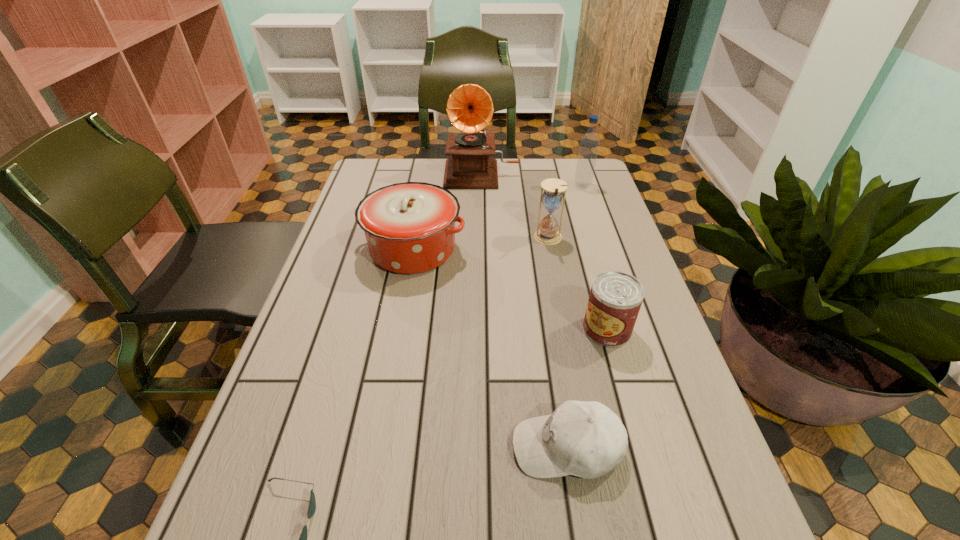
Locate an element on the screen. vacant space located 0.320m on the back of the casserole is located at coordinates (428, 167).

Where is `free space located 0.280m on the left of the third nearest object`? free space located 0.280m on the left of the third nearest object is located at coordinates (455, 329).

The height and width of the screenshot is (540, 960). I want to click on blank area located 0.240m on the front-facing side of the second shortest object, so click(374, 447).

Image resolution: width=960 pixels, height=540 pixels. What are the coordinates of `vacant region located 0.320m on the front-facing side of the second shortest object` in the screenshot? It's located at (328, 447).

Find the location of a particular element. Image resolution: width=960 pixels, height=540 pixels. vacant space situated on the front-facing side of the second shortest object is located at coordinates (386, 447).

Locate an element on the screen. The width and height of the screenshot is (960, 540). phonograph record present at the far edge is located at coordinates (469, 108).

At what (x,y) coordinates should I click in order to perform the action: click on water bottle that is positioned at the far edge. Please return your answer as a coordinate pair (x, y). This screenshot has height=540, width=960. Looking at the image, I should click on (589, 143).

In order to click on object that is positioned at the left edge in this screenshot , I will do `click(409, 227)`.

Identify the location of water bottle located in the right edge section of the desktop. The width and height of the screenshot is (960, 540). (589, 143).

The image size is (960, 540). I want to click on can positioned at the right edge, so click(x=615, y=299).